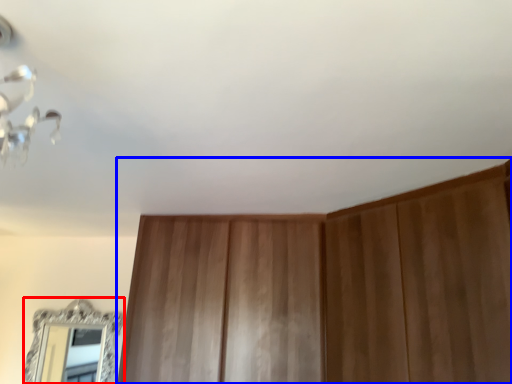
Question: Which of the following is the closest to the observer, mirror (highlighted by a red box) or dresser (highlighted by a blue box)?

Choices:
 (A) mirror
 (B) dresser

Answer: (B)